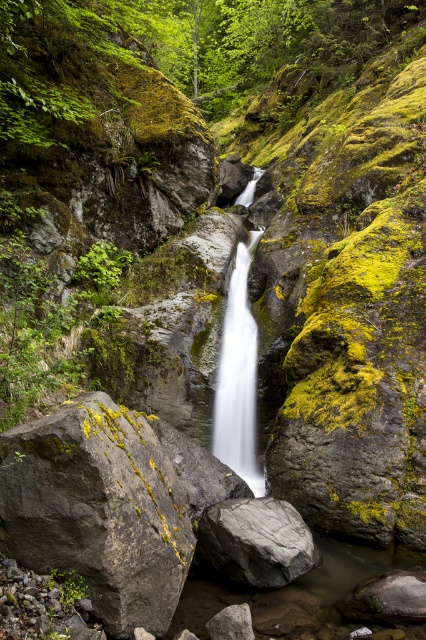
Question: Is gray rock at center closer to camera compared to white smooth waterfall at center?

Choices:
 (A) yes
 (B) no

Answer: (A)

Question: Which point is closer to the camera?

Choices:
 (A) (249, 312)
 (B) (224, 545)

Answer: (B)

Question: Which of the following is the closest to the observer?

Choices:
 (A) (221, 372)
 (B) (221, 568)

Answer: (B)

Question: Among these objects, which one is nearest to the camera?

Choices:
 (A) white smooth waterfall at center
 (B) gray rock at center

Answer: (B)

Question: Can you confirm if gray rock at center is bigger than white smooth waterfall at center?

Choices:
 (A) yes
 (B) no

Answer: (A)

Question: Is gray rock at center bigger than white smooth waterfall at center?

Choices:
 (A) yes
 (B) no

Answer: (A)